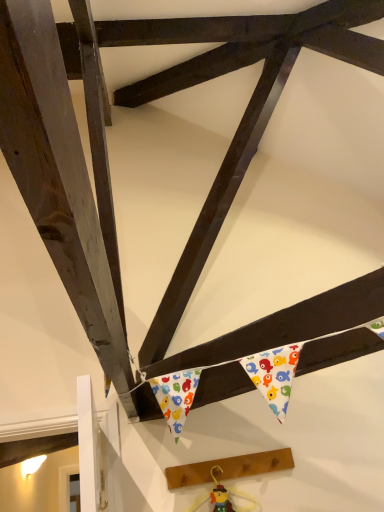
Question: From the image's perspective, is wooden plank at lower center over wooden toy at center?

Choices:
 (A) yes
 (B) no

Answer: (A)

Question: Would you say wooden plank at lower center contains wooden toy at center?

Choices:
 (A) yes
 (B) no

Answer: (A)

Question: Is wooden plank at lower center positioned before wooden toy at center?

Choices:
 (A) no
 (B) yes

Answer: (A)

Question: Is there a large distance between wooden plank at lower center and wooden toy at center?

Choices:
 (A) no
 (B) yes

Answer: (A)

Question: Is wooden plank at lower center with wooden toy at center?

Choices:
 (A) no
 (B) yes

Answer: (B)

Question: Is wooden plank at lower center positioned with its back to wooden toy at center?

Choices:
 (A) yes
 (B) no

Answer: (A)

Question: Considering the relative sizes of wooden toy at center and wooden plank at lower center in the image provided, is wooden toy at center bigger than wooden plank at lower center?

Choices:
 (A) yes
 (B) no

Answer: (B)

Question: Is wooden toy at center positioned far away from wooden plank at lower center?

Choices:
 (A) yes
 (B) no

Answer: (B)

Question: Does wooden toy at center contain wooden plank at lower center?

Choices:
 (A) no
 (B) yes

Answer: (A)

Question: Is wooden toy at center to the left of wooden plank at lower center from the viewer's perspective?

Choices:
 (A) no
 (B) yes

Answer: (B)

Question: Does wooden toy at center have a greater width compared to wooden plank at lower center?

Choices:
 (A) no
 (B) yes

Answer: (A)

Question: From a real-world perspective, is wooden toy at center positioned over wooden plank at lower center based on gravity?

Choices:
 (A) no
 (B) yes

Answer: (A)

Question: From their relative heights in the image, would you say wooden plank at lower center is taller or shorter than wooden toy at center?

Choices:
 (A) tall
 (B) short

Answer: (B)